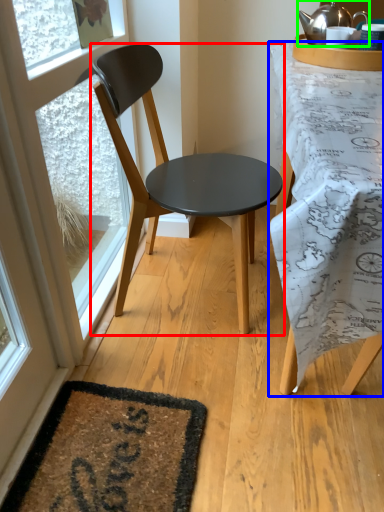
Question: Estimate the real-world distances between objects in this image. Which object is farther from chair (highlighted by a red box), desk (highlighted by a blue box) or kettle (highlighted by a green box)?

Choices:
 (A) desk
 (B) kettle

Answer: (B)